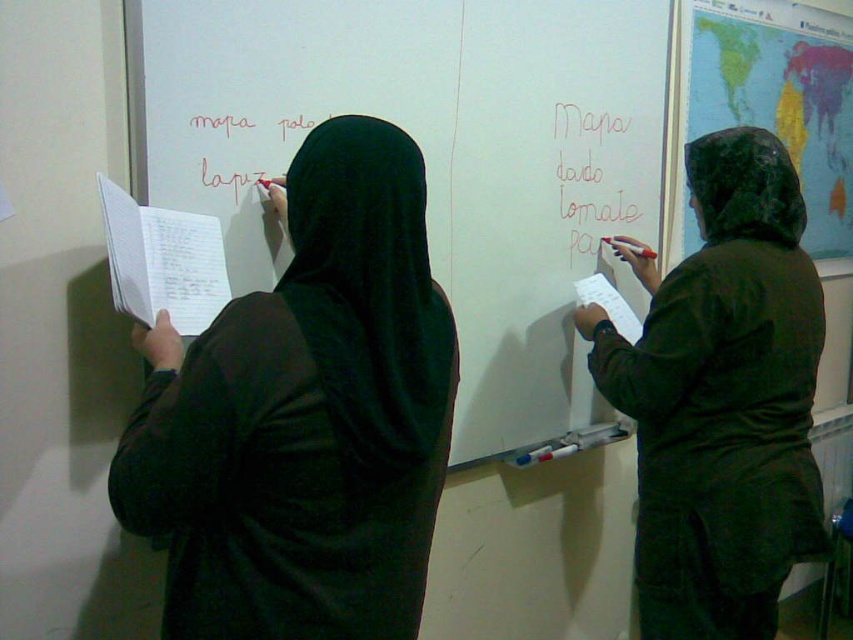
You are a student in the classroom and need to write a long essay. Which object, the white matte whiteboard at upper center or the white paper at center, would be more suitable for writing the essay?

The white matte whiteboard at upper center has a larger size compared to the white paper at center, so it would be more suitable for writing a long essay.

You are standing in a classroom and need to locate the whiteboard. According to the image, where is the white matte whiteboard at upper center?

The white matte whiteboard at upper center is located at point (440, 157).

You are a student trying to reach both the white lined paper at left and the matte red marker at right during a class discussion. The desk between them is 36 inches wide. Can you comfortably reach both items without moving your chair?

The white lined paper at left is 38.57 inches from the matte red marker at right, which is slightly wider than the desk width of 36 inches. Therefore, you may not be able to comfortably reach both items without moving your chair.